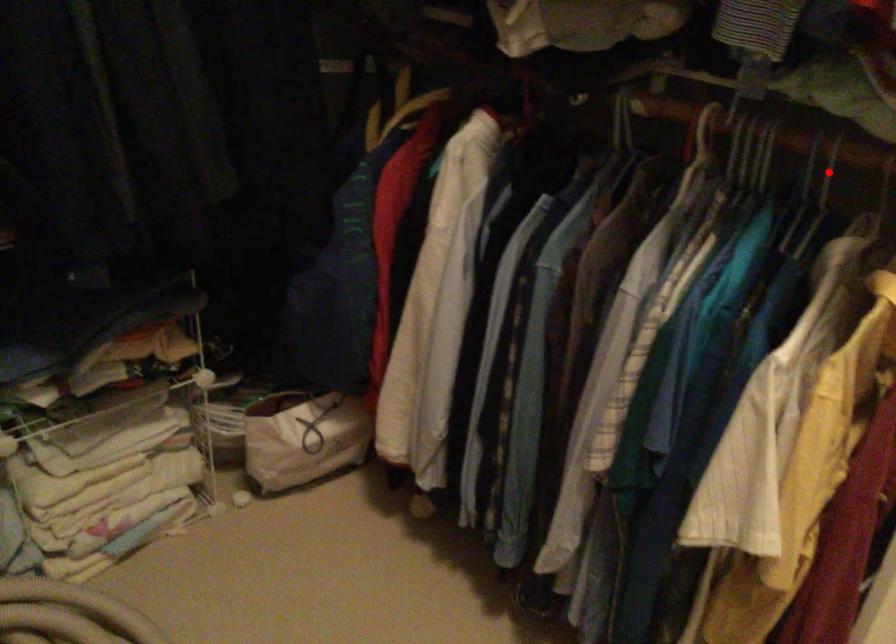
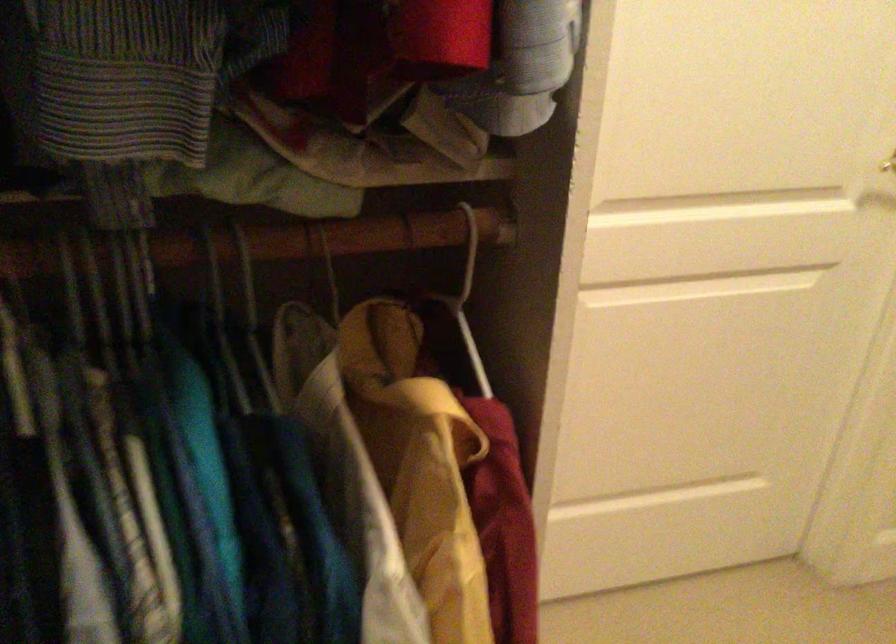
Question: A red point is marked in image1. In image2, is the corresponding 3D point closer to the camera or farther? Reply with the corresponding letter.

Choices:
 (A) The corresponding 3D point is closer.
 (B) The corresponding 3D point is farther.

Answer: (A)